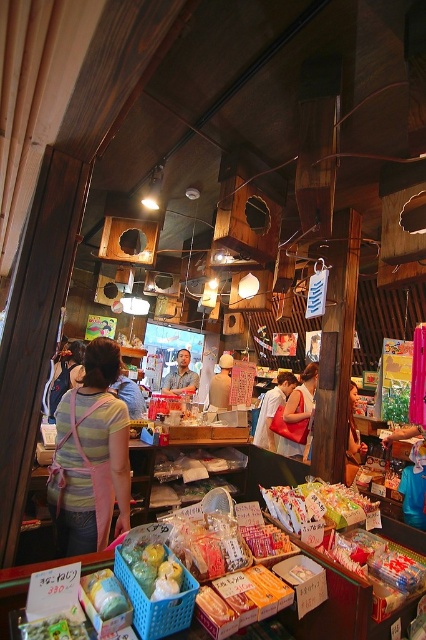
What do you see at coordinates (91, 456) in the screenshot? This screenshot has height=640, width=426. I see `pink fabric apron at center` at bounding box center [91, 456].

Can you confirm if pink fabric apron at center is bigger than matte red bag at center?

No, pink fabric apron at center is not bigger than matte red bag at center.

Is point (85, 461) positioned in front of point (267, 440)?

Yes, point (85, 461) is in front of point (267, 440).

Identify the location of pink fabric apron at center. This screenshot has width=426, height=640. (91, 456).

In order to click on translucent plastic bag at center in this screenshot , I will do `click(152, 570)`.

Is translucent plastic bag at center positioned behind matte red handbag at center?

No, translucent plastic bag at center is in front of matte red handbag at center.

Describe the element at coordinates (152, 570) in the screenshot. I see `translucent plastic bag at center` at that location.

Locate an element on the screen. The width and height of the screenshot is (426, 640). translucent plastic bag at center is located at coordinates (152, 570).

Is shiny plastic candy at center taller than matte red handbag at center?

Incorrect, shiny plastic candy at center's height is not larger of matte red handbag at center's.

What do you see at coordinates (319, 506) in the screenshot?
I see `shiny plastic candy at center` at bounding box center [319, 506].

Image resolution: width=426 pixels, height=640 pixels. Find the location of `shiny plastic candy at center`. shiny plastic candy at center is located at coordinates (319, 506).